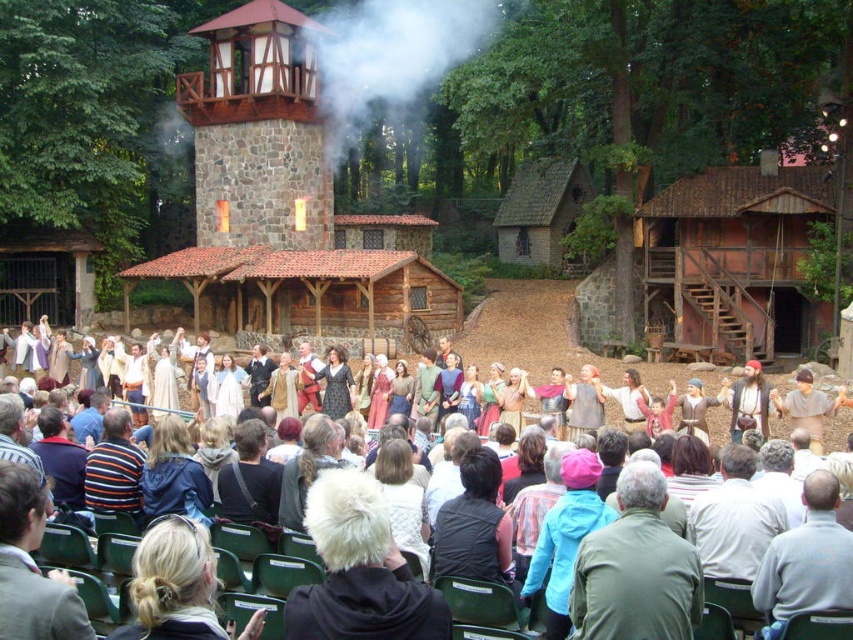
You are a photographer standing at the front of the audience. You want to take a photo of the green fabric jacket at center. Which direction should you point your camera to capture it?

You should point your camera towards the center of the stage area to capture the green fabric jacket at center, as it is located at point coordinates (636, 570).

You are standing at point (636,570) in the scene. What object is located exactly at this point?

The green fabric jacket at center is located exactly at point (636,570).